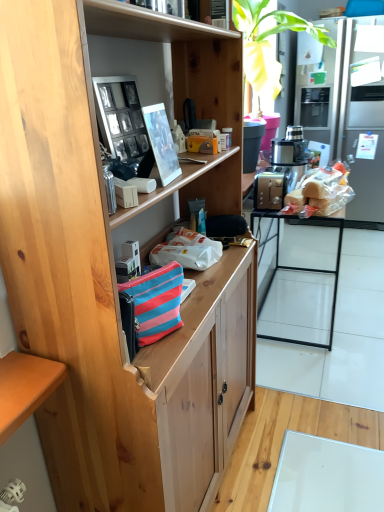
Question: Is metallic silver food processor at center-right surrounding striped fabric handbag at center?

Choices:
 (A) yes
 (B) no

Answer: (B)

Question: Could you tell me if metallic silver food processor at center-right is facing striped fabric handbag at center?

Choices:
 (A) no
 (B) yes

Answer: (A)

Question: Is there a large distance between metallic silver food processor at center-right and striped fabric handbag at center?

Choices:
 (A) yes
 (B) no

Answer: (A)

Question: Is metallic silver food processor at center-right turned away from striped fabric handbag at center?

Choices:
 (A) yes
 (B) no

Answer: (B)

Question: Is metallic silver food processor at center-right with striped fabric handbag at center?

Choices:
 (A) no
 (B) yes

Answer: (A)

Question: Does metallic silver food processor at center-right lie in front of striped fabric handbag at center?

Choices:
 (A) no
 (B) yes

Answer: (A)

Question: Is white glossy table at center bigger than matte plastic picture frame at upper center, acting as the second picture frame starting from the left?

Choices:
 (A) no
 (B) yes

Answer: (B)

Question: Could matte plastic picture frame at upper center, acting as the second picture frame starting from the left, be considered to be inside white glossy table at center?

Choices:
 (A) yes
 (B) no

Answer: (B)

Question: From a real-world perspective, does white glossy table at center sit lower than matte plastic picture frame at upper center, acting as the second picture frame starting from the left?

Choices:
 (A) no
 (B) yes

Answer: (B)

Question: From a real-world perspective, is white glossy table at center on matte plastic picture frame at upper center, arranged as the 1th picture frame when viewed from the right?

Choices:
 (A) yes
 (B) no

Answer: (B)

Question: Is white glossy table at center placed right next to matte plastic picture frame at upper center, acting as the second picture frame starting from the left?

Choices:
 (A) no
 (B) yes

Answer: (A)

Question: Is white glossy table at center thinner than matte plastic picture frame at upper center, arranged as the 1th picture frame when viewed from the right?

Choices:
 (A) yes
 (B) no

Answer: (B)

Question: Is silver metallic refrigerator at right far away from striped fabric handbag at center?

Choices:
 (A) yes
 (B) no

Answer: (A)